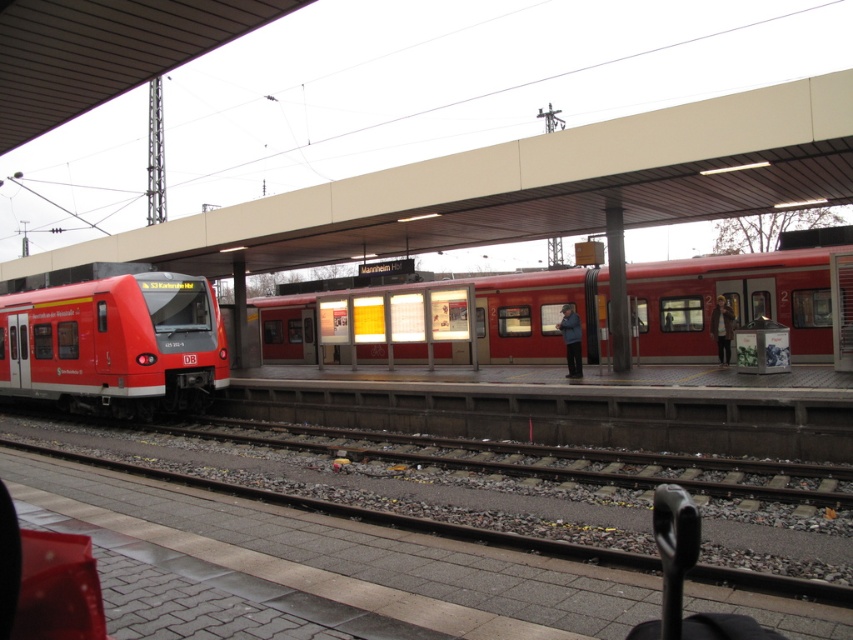
Question: Among these points, which one is nearest to the camera?

Choices:
 (A) (x=173, y=298)
 (B) (x=480, y=284)

Answer: (A)

Question: Which point is closer to the camera?

Choices:
 (A) matte red train at center
 (B) matte red train at left

Answer: (A)

Question: Is matte red train at center wider than matte red train at left?

Choices:
 (A) yes
 (B) no

Answer: (A)

Question: Is matte red train at center positioned at the back of matte red train at left?

Choices:
 (A) yes
 (B) no

Answer: (B)

Question: Is matte red train at center wider than matte red train at left?

Choices:
 (A) yes
 (B) no

Answer: (A)

Question: Which of the following is the closest to the observer?

Choices:
 (A) (7, 307)
 (B) (311, 300)

Answer: (A)